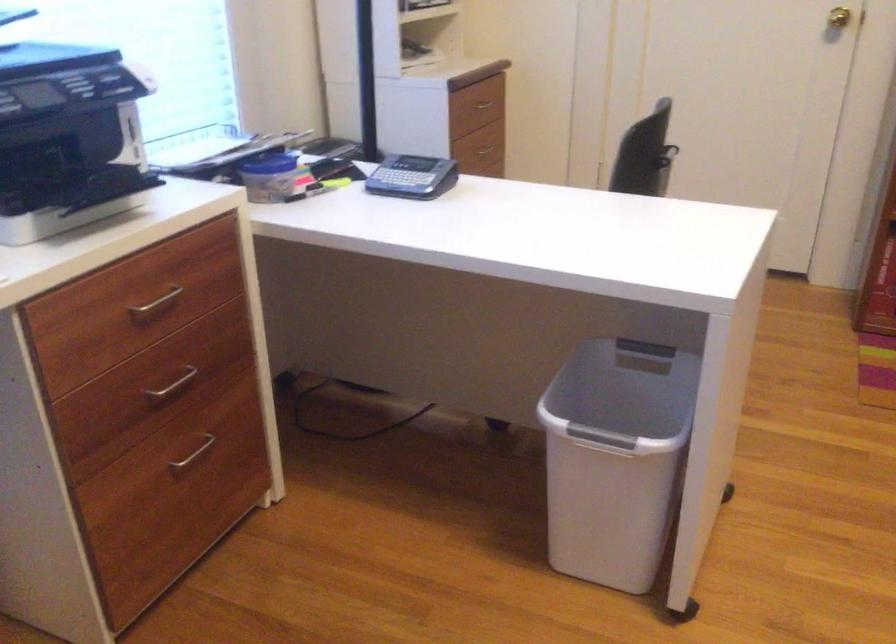
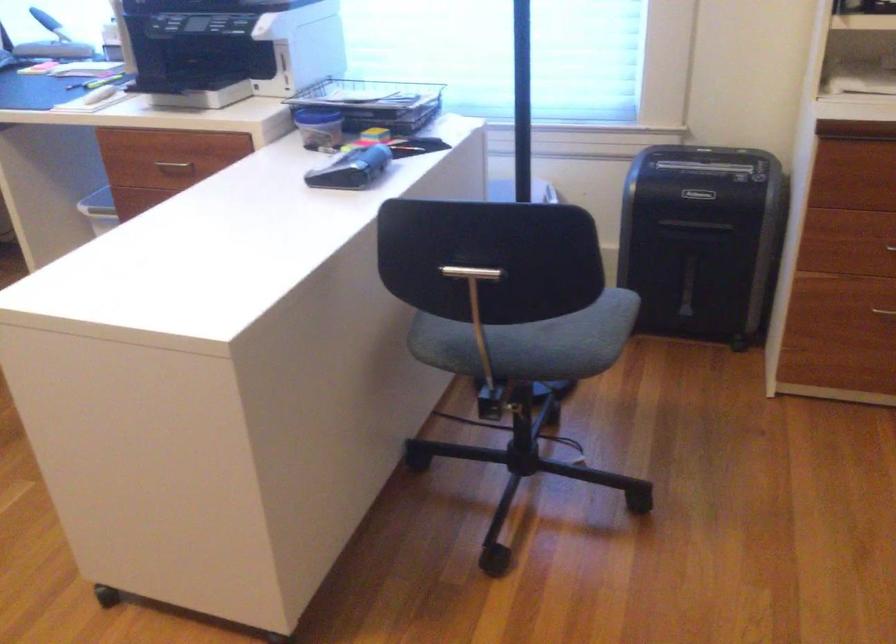
Find the pixel in the second image that matches the point at 152,310 in the first image.

(174, 165)